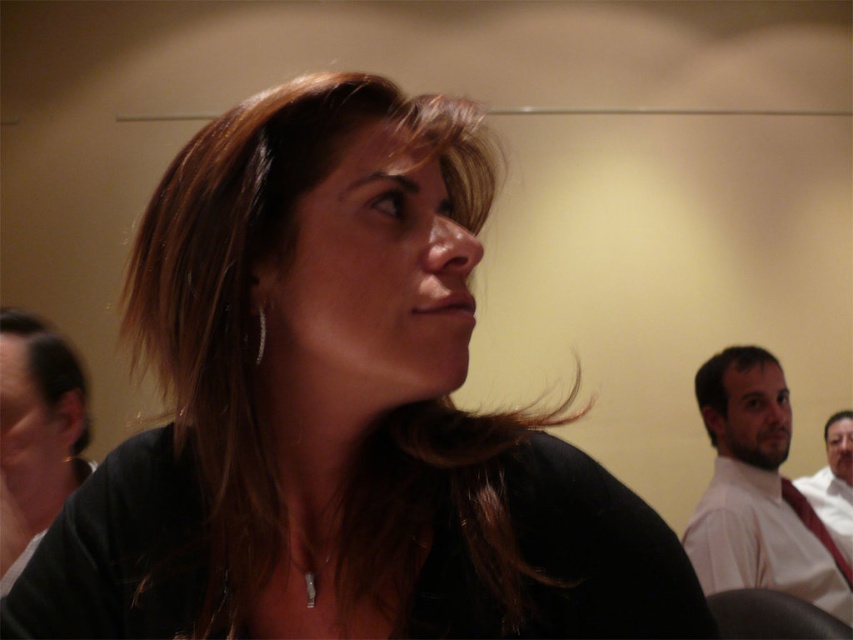
Question: Which of the following is the closest to the observer?

Choices:
 (A) smooth white shirt at right
 (B) silver metallic earring at upper left
 (C) matte black hair at center

Answer: (C)

Question: Which point is farther from the camera taking this photo?

Choices:
 (A) (704, 406)
 (B) (825, 428)
 (C) (51, 392)

Answer: (B)

Question: Which object is positioned closest to the matte black hair at center?

Choices:
 (A) white shirt at right
 (B) red silk tie at right
 (C) dark brown hair at right
 (D) silver metallic earring at upper left

Answer: (D)

Question: Does brownhair at left appear on the right side of white shirt at right?

Choices:
 (A) no
 (B) yes

Answer: (A)

Question: Can you confirm if matte black hair at center is positioned above brownhair at left?

Choices:
 (A) no
 (B) yes

Answer: (B)

Question: Is smooth white shirt at right bigger than white shirt at right?

Choices:
 (A) no
 (B) yes

Answer: (B)